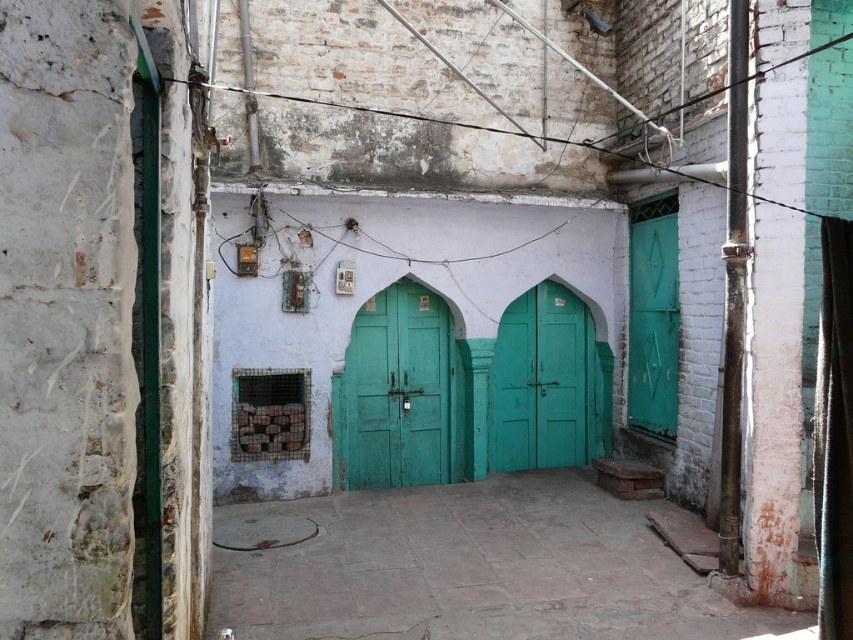
Based on the photo, you are a delivery person trying to enter the teal matte door at center and the green matte door at center in the alleyway. Since both doors are closed, which one do you need to open first to access the space behind them?

The teal matte door at center is in front of the green matte door at center, so you need to open the teal matte door at center first to reach the green one behind it.

You are standing in the alleyway and notice two doors at the center. The teal matte door at center and the green matte door at center. Which one is positioned lower?

The teal matte door at center is below the green matte door at center, so it is positioned lower.